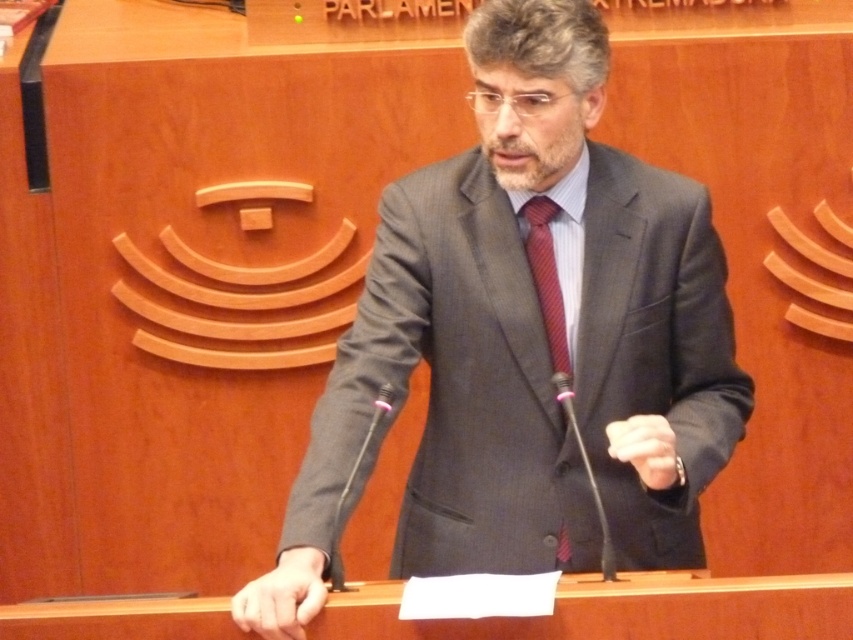
Is matte gray suit at center positioned before red striped tie at center?

That is True.

Is point (646, 333) more distant than point (558, 371)?

Yes, point (646, 333) is behind point (558, 371).

Identify the location of matte gray suit at center. Image resolution: width=853 pixels, height=640 pixels. (527, 339).

Identify the location of matte gray suit at center. (527, 339).